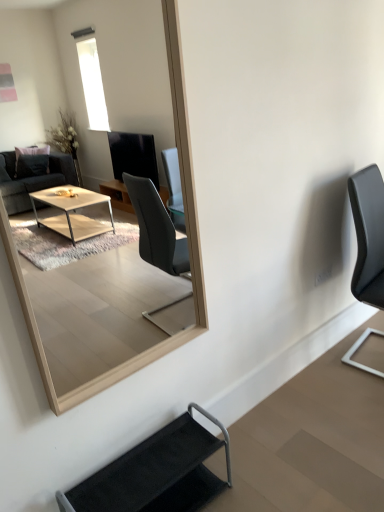
Identify the location of vacant space that is in between black leather chair at right, the 1th chair positioned from the back, and black fabric chair at lower center, marked as the second chair in a right-to-left arrangement. The image size is (384, 512). (297, 413).